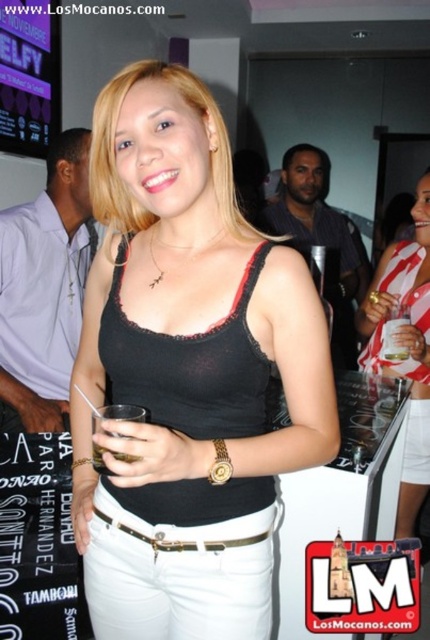
Question: Which object is positioned closest to the gold metallic belt at center?

Choices:
 (A) black matte tank top at center
 (B) matte black tank top at center

Answer: (A)

Question: Which of these objects is positioned closest to the black matte tank top at center?

Choices:
 (A) gold metallic belt at center
 (B) matte black tank top at center

Answer: (A)

Question: Is black matte tank top at center to the right of gold metallic belt at center from the viewer's perspective?

Choices:
 (A) yes
 (B) no

Answer: (B)

Question: Can you confirm if black matte tank top at center is positioned below gold metallic belt at center?

Choices:
 (A) no
 (B) yes

Answer: (A)

Question: Can you confirm if black matte tank top at center is positioned to the right of gold metallic belt at center?

Choices:
 (A) yes
 (B) no

Answer: (B)

Question: Which point is farther to the camera?

Choices:
 (A) (396, 256)
 (B) (153, 314)
 (C) (97, 513)

Answer: (A)